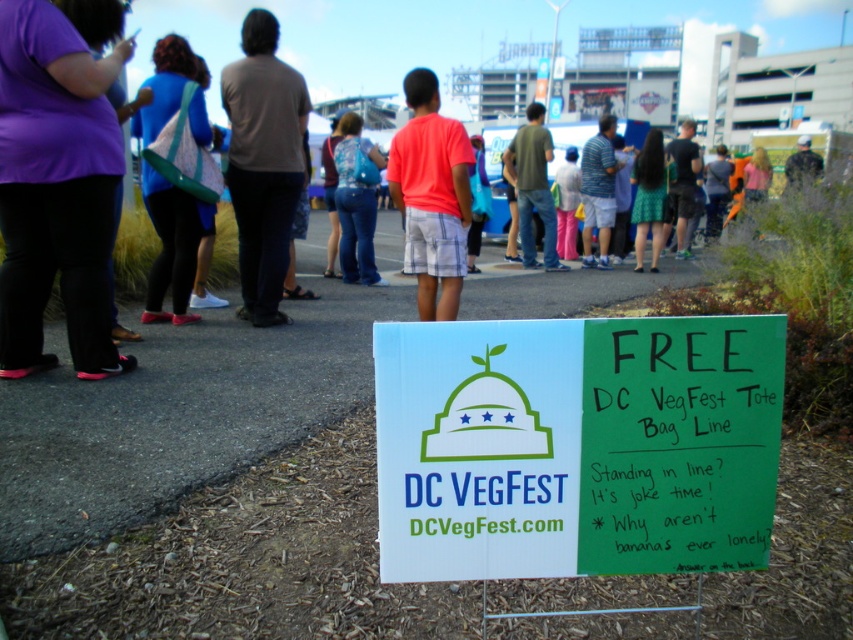
Question: Among these objects, which one is nearest to the camera?

Choices:
 (A) blue denim jeans at center
 (B) dark gray shirt at center
 (C) white cardboard sign at center

Answer: (C)

Question: Does purple fabric at left appear under blue denim jeans at center?

Choices:
 (A) yes
 (B) no

Answer: (A)

Question: Is white cardboard sign at center wider than matte black shirt at center?

Choices:
 (A) no
 (B) yes

Answer: (A)

Question: Among these points, which one is farthest from the camera?

Choices:
 (A) (250, 122)
 (B) (526, 36)
 (C) (589, 209)
 (D) (799, 163)

Answer: (B)

Question: Does blue denim jeans at center have a larger size compared to green cotton shirt at center?

Choices:
 (A) no
 (B) yes

Answer: (A)

Question: Which point is closer to the camera?

Choices:
 (A) click(550, 145)
 (B) click(155, 24)

Answer: (A)